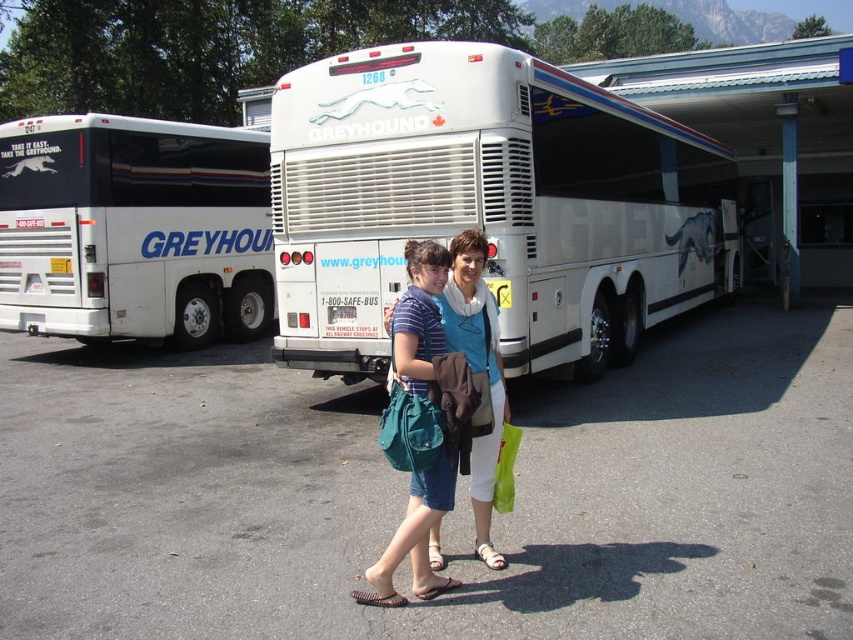
Question: Is the position of white matte/greyhound bus at left less distant than that of teal fabric bag at center?

Choices:
 (A) no
 (B) yes

Answer: (A)

Question: Is white matte bus at center above white matte/greyhound bus at left?

Choices:
 (A) no
 (B) yes

Answer: (A)

Question: Can you confirm if white matte/greyhound bus at left is wider than teal fabric bag at center?

Choices:
 (A) yes
 (B) no

Answer: (B)

Question: Which point appears farthest from the camera in this image?

Choices:
 (A) (404, 291)
 (B) (798, 272)

Answer: (B)

Question: Among these objects, which one is farthest from the camera?

Choices:
 (A) teal fabric bag at center
 (B) white matte bus at center
 (C) white glossy bus at upper center
 (D) white matte/greyhound bus at left

Answer: (C)

Question: Which point is farther to the camera?

Choices:
 (A) white glossy bus at upper center
 (B) teal fabric bag at center
 (C) white matte/greyhound bus at left

Answer: (A)